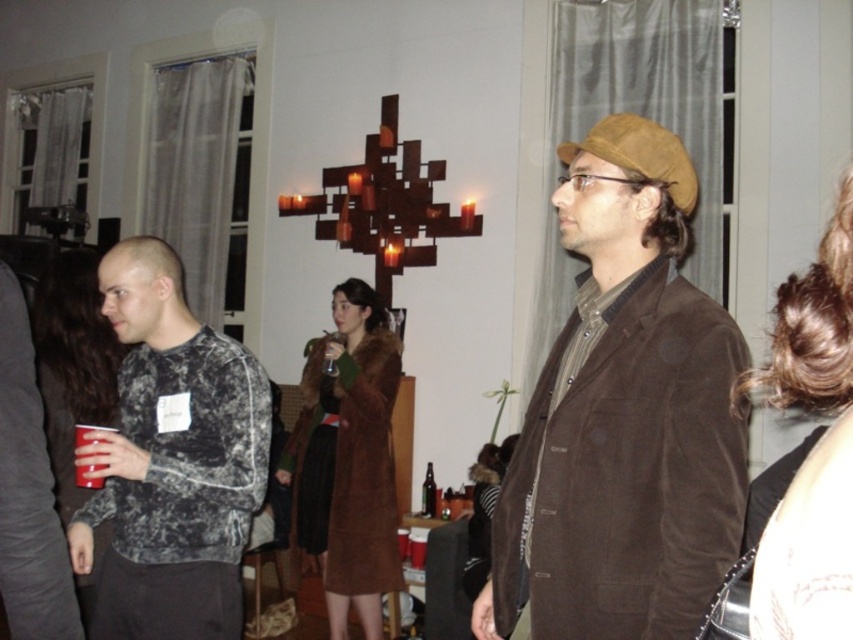
Question: In this image, where is dark brown hair at right located relative to matte black sweater at left?

Choices:
 (A) left
 (B) right

Answer: (B)

Question: Among these objects, which one is nearest to the camera?

Choices:
 (A) brown fur coat at center
 (B) dark brown hair at right

Answer: (B)

Question: Which point is farther from the camera taking this photo?

Choices:
 (A) (421, 484)
 (B) (97, 484)

Answer: (A)

Question: Is dark brown hair at right positioned behind brown fur coat at center?

Choices:
 (A) no
 (B) yes

Answer: (A)

Question: Which object is closer to the camera taking this photo?

Choices:
 (A) matte plastic cup at lower left
 (B) dark brown hair at right

Answer: (B)

Question: Does brown fur coat at center have a smaller size compared to brown glass bottle at center?

Choices:
 (A) yes
 (B) no

Answer: (B)